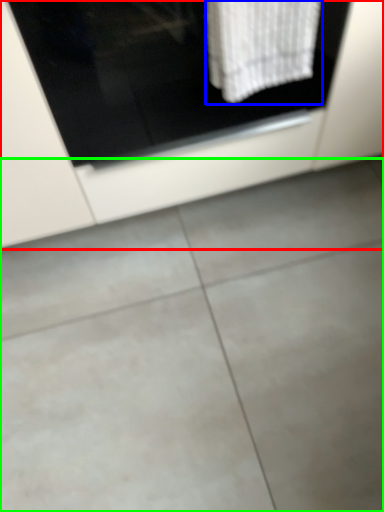
Question: Which object is positioned closest to cabinetry (highlighted by a red box)? Select from bath towel (highlighted by a blue box) and concrete (highlighted by a green box).

Choices:
 (A) bath towel
 (B) concrete

Answer: (A)